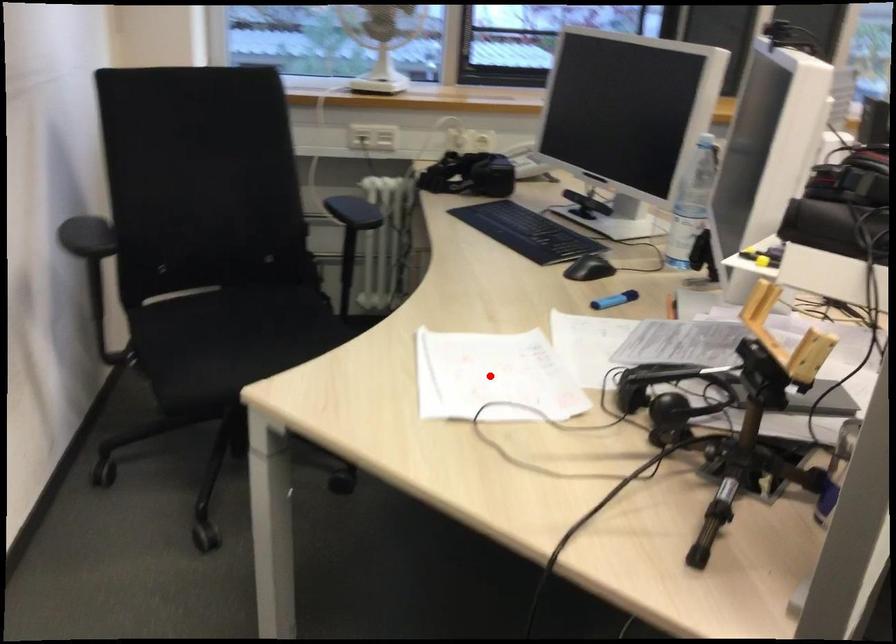
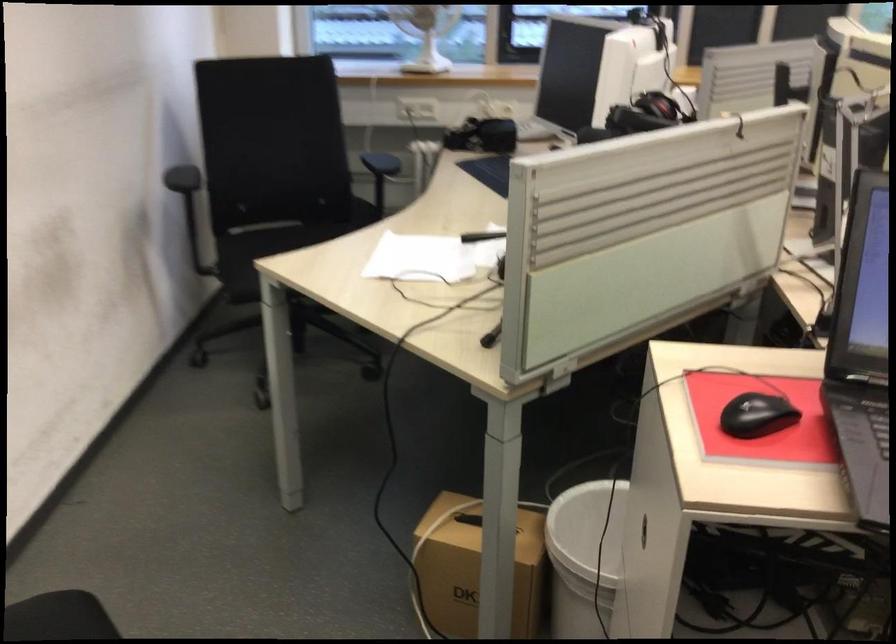
Where in the second image is the point corresponding to the highlighted location from the first image?

(419, 259)